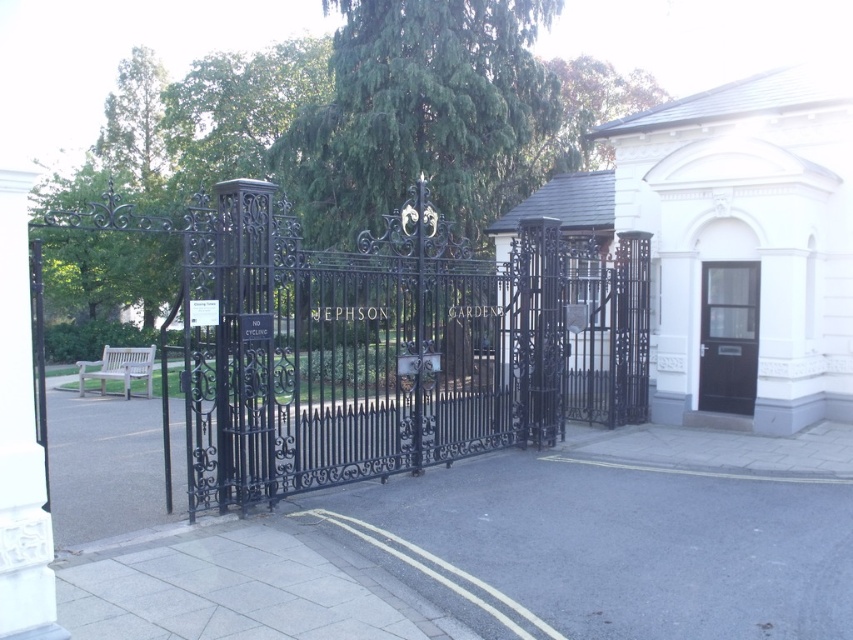
You are a visitor approaching the entrance of Jephson Gardens. You see the black wrought iron gate at center and the black wooden door at right. Which object is closer to you as you approach the entrance?

The black wrought iron gate at center is closer to you as you approach the entrance because it is in front of the black wooden door at right.